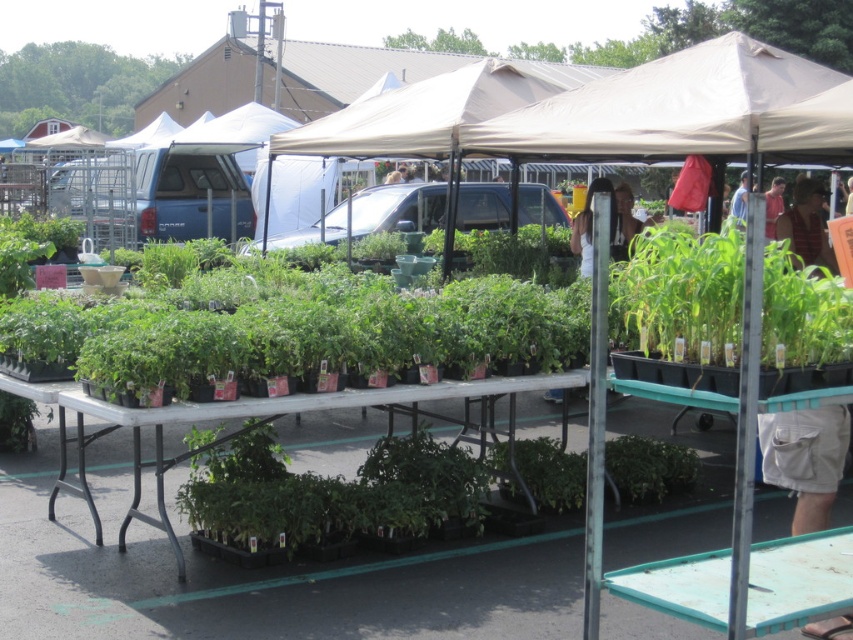
Question: Considering the relative positions of green matte plants at center and beige fabric tent at center in the image provided, where is green matte plants at center located with respect to beige fabric tent at center?

Choices:
 (A) left
 (B) right

Answer: (A)

Question: In this image, where is green matte plants at center located relative to green matte plant at center?

Choices:
 (A) right
 (B) left

Answer: (B)

Question: Among these objects, which one is nearest to the camera?

Choices:
 (A) green plastic table at center
 (B) green matte plant at center
 (C) green matte plants at center
 (D) beige fabric tent at center

Answer: (A)

Question: Is green matte plants at center to the left of beige fabric tent at center from the viewer's perspective?

Choices:
 (A) no
 (B) yes

Answer: (B)

Question: Among these objects, which one is farthest from the camera?

Choices:
 (A) green matte plants at center
 (B) beige fabric tent at center

Answer: (B)

Question: Which point is farther from the camera taking this photo?

Choices:
 (A) coord(415,124)
 (B) coord(683,451)
 (C) coord(672,346)

Answer: (A)